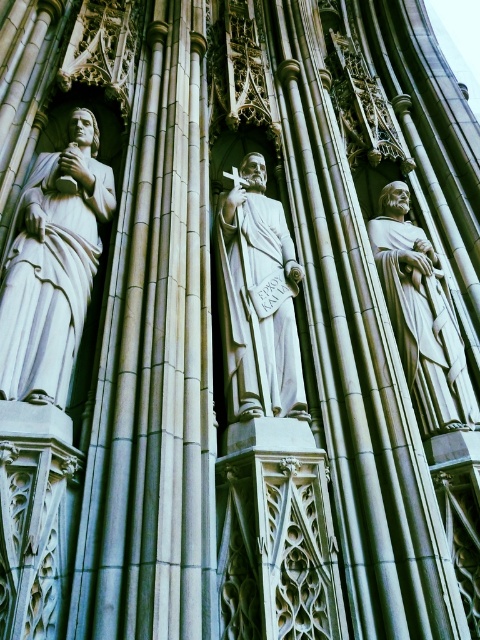
You are an art conservator examining the statues on the cathedral facade. You need to inspect the white marble statue at left and the white marble statue at right. Which statue will require you to climb fewer stairs to reach?

The white marble statue at left is closer to the viewer than the white marble statue at right, so you will need to climb fewer stairs to reach the white marble statue at left.